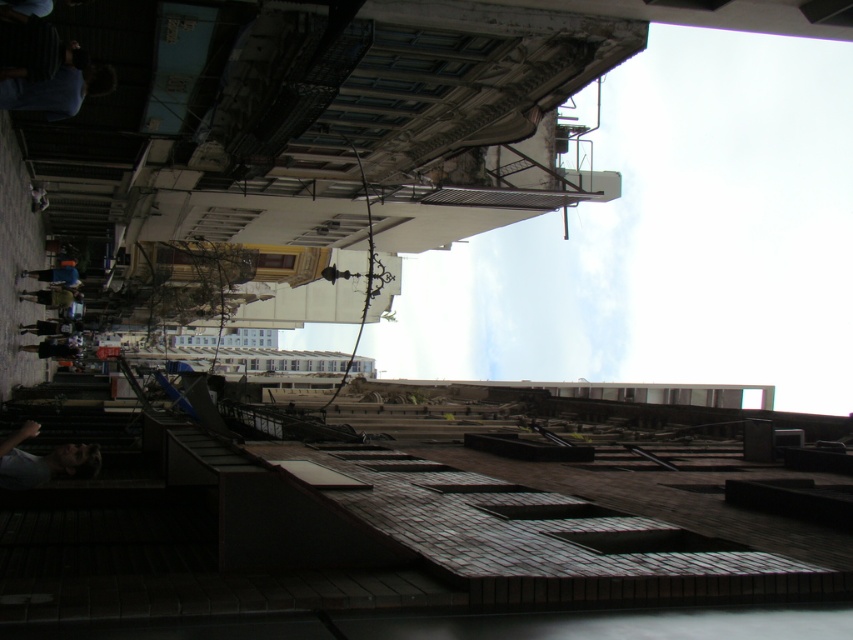
You are standing in the plaza looking up at the buildings. Where is the light blue fabric at lower left located in terms of its 2D coordinates?

The light blue fabric at lower left is located at the 2D coordinates of point [44,460].

You are a photographer setting up a shot of the street scene. You notice two items in the frame that could distract from the main subject. The light blue fabric at lower left and the blue denim jacket at left. Which of these two items takes up more space in the frame?

The blue denim jacket at left takes up more space in the frame than the light blue fabric at lower left because the light blue fabric at lower left occupies less space than blue denim jacket at left.